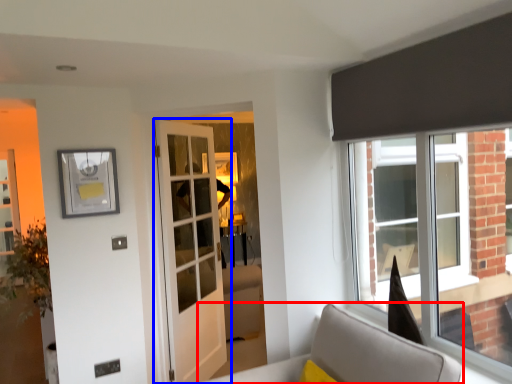
Question: Which of the following is the closest to the observer, furniture (highlighted by a red box) or door (highlighted by a blue box)?

Choices:
 (A) furniture
 (B) door

Answer: (A)